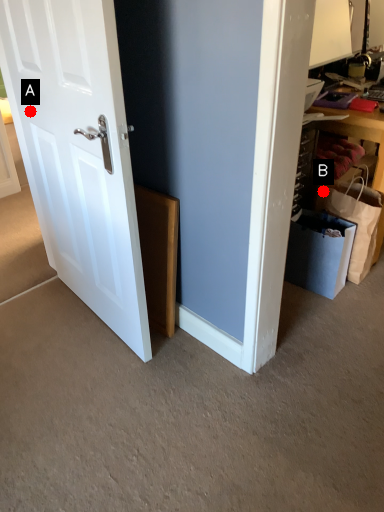
Question: Two points are circled on the image, labeled by A and B beside each circle. Which of the following is the closest to the observer?

Choices:
 (A) A is closer
 (B) B is closer

Answer: (A)